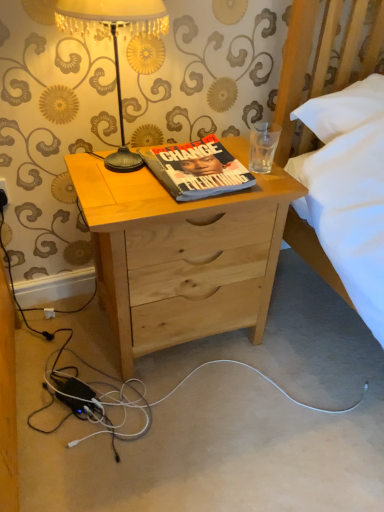
Find the location of `free point in front of hardcover book at center`. free point in front of hardcover book at center is located at coordinates (168, 202).